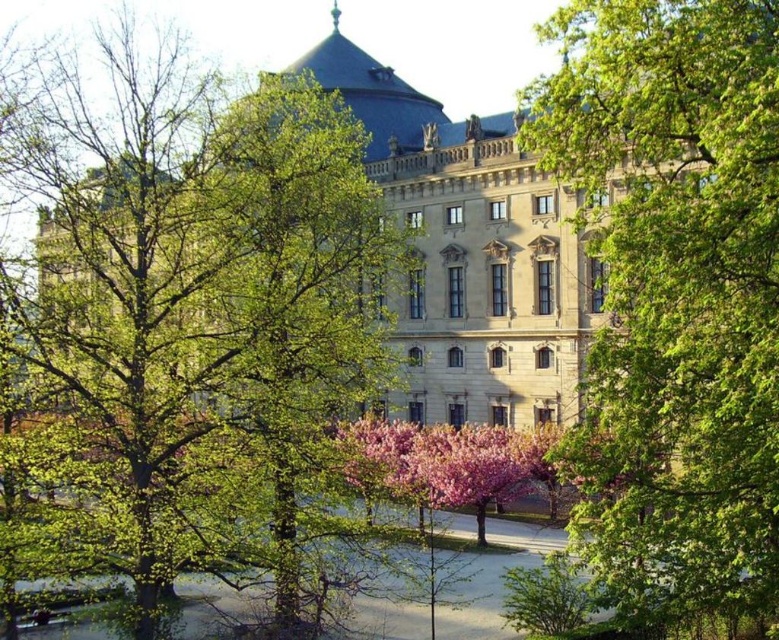
Question: Which object is farther from the camera taking this photo?

Choices:
 (A) green leafy tree at left
 (B) stone gray palace at center
 (C) green leafy tree at center

Answer: (B)

Question: Is green leafy tree at left closer to the viewer compared to stone gray palace at center?

Choices:
 (A) no
 (B) yes

Answer: (B)

Question: Is green leafy tree at center thinner than stone gray palace at center?

Choices:
 (A) no
 (B) yes

Answer: (B)

Question: Which object appears closest to the camera in this image?

Choices:
 (A) stone gray palace at center
 (B) green leafy tree at center

Answer: (B)

Question: Does green leafy tree at left appear on the right side of stone gray palace at center?

Choices:
 (A) yes
 (B) no

Answer: (B)

Question: Which object is positioned farthest from the green leafy tree at left?

Choices:
 (A) stone gray palace at center
 (B) green leafy tree at center

Answer: (B)